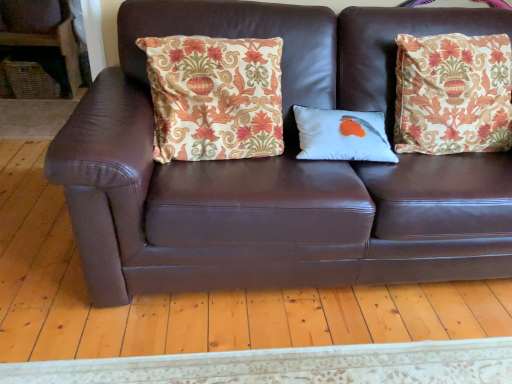
What do you see at coordinates (215, 97) in the screenshot?
I see `patterned fabric pillow at center, the second pillow positioned from the right` at bounding box center [215, 97].

Image resolution: width=512 pixels, height=384 pixels. Describe the element at coordinates (277, 169) in the screenshot. I see `brown leather couch at center` at that location.

The height and width of the screenshot is (384, 512). Find the location of `woven wicker basket at left`. woven wicker basket at left is located at coordinates (38, 50).

This screenshot has height=384, width=512. Find the location of `patterned fabric pillow at center, the second pillow positioned from the right`. patterned fabric pillow at center, the second pillow positioned from the right is located at coordinates (215, 97).

From a real-world perspective, is woven wicker basket at left positioned above or below white matte pillow with bird design at center, acting as the first pillow starting from the right?

woven wicker basket at left is below white matte pillow with bird design at center, acting as the first pillow starting from the right.

Between point (69, 40) and point (383, 126), which one is positioned in front?

The point (383, 126) is closer to the camera.

Is woven wicker basket at left thinner than white matte pillow with bird design at center, which is counted as the second pillow, starting from the left?

No, woven wicker basket at left is not thinner than white matte pillow with bird design at center, which is counted as the second pillow, starting from the left.

From the image's perspective, does woven wicker basket at left appear higher than white matte pillow with bird design at center, acting as the first pillow starting from the right?

Yes.

Is white matte pillow with bird design at center, acting as the first pillow starting from the right, next to woven wicker basket at left and touching it?

white matte pillow with bird design at center, acting as the first pillow starting from the right, is not next to woven wicker basket at left, and they're not touching.

From the image's perspective, is white matte pillow with bird design at center, acting as the first pillow starting from the right, located above woven wicker basket at left?

No, from the image's perspective, white matte pillow with bird design at center, acting as the first pillow starting from the right, is not on top of woven wicker basket at left.

From a real-world perspective, is white matte pillow with bird design at center, acting as the first pillow starting from the right, on woven wicker basket at left?

Yes, from a real-world perspective, white matte pillow with bird design at center, acting as the first pillow starting from the right, is over woven wicker basket at left

Find the location of a particular element. armchair located on the left of white matte pillow with bird design at center, acting as the first pillow starting from the right is located at coordinates (38, 50).

Is there a large distance between brown leather couch at center and patterned fabric pillow at center, the first pillow from the left?

They are positioned close to each other.

Is brown leather couch at center bigger than patterned fabric pillow at center, the second pillow positioned from the right?

Correct, brown leather couch at center is larger in size than patterned fabric pillow at center, the second pillow positioned from the right.

Considering the sizes of brown leather couch at center and patterned fabric pillow at center, the first pillow from the left, in the image, is brown leather couch at center taller or shorter than patterned fabric pillow at center, the first pillow from the left,?

In the image, brown leather couch at center appears to be taller than patterned fabric pillow at center, the first pillow from the left.

Can you tell me how much brown leather couch at center and patterned fabric pillow at center, the first pillow from the left, differ in facing direction?

The facing directions of brown leather couch at center and patterned fabric pillow at center, the first pillow from the left, are 3.28 degrees apart.

Can you confirm if woven wicker basket at left is wider than patterned fabric pillow at center, the second pillow positioned from the right?

Yes, woven wicker basket at left is wider than patterned fabric pillow at center, the second pillow positioned from the right.

Does woven wicker basket at left appear on the right side of patterned fabric pillow at center, the first pillow from the left?

No, woven wicker basket at left is not to the right of patterned fabric pillow at center, the first pillow from the left.

From the image's perspective, who appears lower, woven wicker basket at left or patterned fabric pillow at center, the second pillow positioned from the right?

patterned fabric pillow at center, the second pillow positioned from the right.

Considering the relative sizes of woven wicker basket at left and patterned fabric pillow at center, the second pillow positioned from the right, in the image provided, is woven wicker basket at left shorter than patterned fabric pillow at center, the second pillow positioned from the right,?

Incorrect, the height of woven wicker basket at left does not fall short of that of patterned fabric pillow at center, the second pillow positioned from the right.

From a real-world perspective, who is located lower, woven wicker basket at left or brown leather couch at center?

woven wicker basket at left, from a real-world perspective.

Does point (62, 23) come in front of point (375, 10)?

No, (62, 23) is further to viewer.

Is woven wicker basket at left to the right of brown leather couch at center from the viewer's perspective?

No.

Consider the image. Which of these two, woven wicker basket at left or brown leather couch at center, is wider?

brown leather couch at center.

Locate an element on the screen. The image size is (512, 384). studio couch below the woven wicker basket at left (from the image's perspective) is located at coordinates (277, 169).

Considering the positions of objects brown leather couch at center and woven wicker basket at left in the image provided, who is more to the left, brown leather couch at center or woven wicker basket at left?

From the viewer's perspective, woven wicker basket at left appears more on the left side.

Is woven wicker basket at left surrounded by brown leather couch at center?

No, brown leather couch at center does not contain woven wicker basket at left.

Is point (141, 160) closer to viewer compared to point (26, 36)?

Yes, point (141, 160) is in front of point (26, 36).

Is white matte pillow with bird design at center, acting as the first pillow starting from the right, at the back of patterned fabric pillow at center, the second pillow positioned from the right?

No, patterned fabric pillow at center, the second pillow positioned from the right, is not facing the opposite direction of white matte pillow with bird design at center, acting as the first pillow starting from the right.

How different are the orientations of patterned fabric pillow at center, the second pillow positioned from the right, and white matte pillow with bird design at center, which is counted as the second pillow, starting from the left, in degrees?

The angle between the facing direction of patterned fabric pillow at center, the second pillow positioned from the right, and the facing direction of white matte pillow with bird design at center, which is counted as the second pillow, starting from the left, is 4.28 degrees.

Between patterned fabric pillow at center, the first pillow from the left, and white matte pillow with bird design at center, which is counted as the second pillow, starting from the left, which one appears on the left side from the viewer's perspective?

Positioned to the left is patterned fabric pillow at center, the first pillow from the left.

Would you say patterned fabric pillow at center, the first pillow from the left, is outside white matte pillow with bird design at center, which is counted as the second pillow, starting from the left?

patterned fabric pillow at center, the first pillow from the left, lies outside white matte pillow with bird design at center, which is counted as the second pillow, starting from the left,'s area.

Where is `armchair that appears on the left of white matte pillow with bird design at center, which is counted as the second pillow, starting from the left`? The height and width of the screenshot is (384, 512). armchair that appears on the left of white matte pillow with bird design at center, which is counted as the second pillow, starting from the left is located at coordinates (38, 50).

The width and height of the screenshot is (512, 384). Find the location of `armchair lying above the white matte pillow with bird design at center, which is counted as the second pillow, starting from the left (from the image's perspective)`. armchair lying above the white matte pillow with bird design at center, which is counted as the second pillow, starting from the left (from the image's perspective) is located at coordinates (38, 50).

When comparing their distances from white matte pillow with bird design at center, which is counted as the second pillow, starting from the left, does patterned fabric pillow at center, the second pillow positioned from the right, or woven wicker basket at left seem further?

Among the two, woven wicker basket at left is located further to white matte pillow with bird design at center, which is counted as the second pillow, starting from the left.

Looking at the image, which one is located further to patterned fabric pillow at center, the first pillow from the left, brown leather couch at center or white matte pillow with bird design at center, acting as the first pillow starting from the right?

white matte pillow with bird design at center, acting as the first pillow starting from the right.

When comparing their distances from white matte pillow with bird design at center, which is counted as the second pillow, starting from the left, does patterned fabric pillow at center, the second pillow positioned from the right, or brown leather couch at center seem closer?

Based on the image, patterned fabric pillow at center, the second pillow positioned from the right, appears to be nearer to white matte pillow with bird design at center, which is counted as the second pillow, starting from the left.

Looking at the image, which one is located further to brown leather couch at center, woven wicker basket at left or patterned fabric pillow at center, the second pillow positioned from the right?

woven wicker basket at left is positioned further to the anchor brown leather couch at center.

Which object lies nearer to the anchor point woven wicker basket at left, white matte pillow with bird design at center, acting as the first pillow starting from the right, or patterned fabric pillow at center, the second pillow positioned from the right?

patterned fabric pillow at center, the second pillow positioned from the right, is positioned closer to the anchor woven wicker basket at left.

Estimate the real-world distances between objects in this image. Which object is further from white matte pillow with bird design at center, which is counted as the second pillow, starting from the left, woven wicker basket at left or patterned fabric pillow at center, the first pillow from the left?

woven wicker basket at left.

Looking at the image, which one is located closer to patterned fabric pillow at center, the second pillow positioned from the right, woven wicker basket at left or white matte pillow with bird design at center, acting as the first pillow starting from the right?

The object closer to patterned fabric pillow at center, the second pillow positioned from the right, is white matte pillow with bird design at center, acting as the first pillow starting from the right.

Based on their spatial positions, is patterned fabric pillow at center, the second pillow positioned from the right, or white matte pillow with bird design at center, which is counted as the second pillow, starting from the left, further from brown leather couch at center?

Among the two, white matte pillow with bird design at center, which is counted as the second pillow, starting from the left, is located further to brown leather couch at center.

Locate an element on the screen. This screenshot has width=512, height=384. pillow located between patterned fabric pillow at center, the second pillow positioned from the right, and brown leather couch at center in the left-right direction is located at coordinates (342, 135).

The height and width of the screenshot is (384, 512). Find the location of `pillow located between woven wicker basket at left and white matte pillow with bird design at center, which is counted as the second pillow, starting from the left, in the left-right direction`. pillow located between woven wicker basket at left and white matte pillow with bird design at center, which is counted as the second pillow, starting from the left, in the left-right direction is located at coordinates (215, 97).